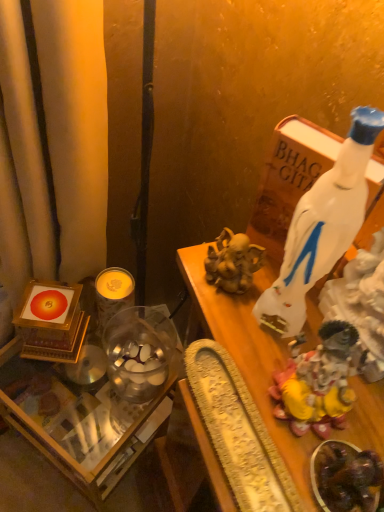
What is the approximate height of white glossy bottle at upper right?

white glossy bottle at upper right is 9.75 inches in height.

What are the coordinates of `shiny dark chocolate at lower right` in the screenshot? It's located at (345, 477).

What is the approximate width of translucent glass table at lower left?

It is 14.54 inches.

Image resolution: width=384 pixels, height=512 pixels. What do you see at coordinates (247, 354) in the screenshot? I see `gold textured tray at center` at bounding box center [247, 354].

I want to click on shiny gold statue at right, so click(x=317, y=382).

From the image's perspective, which is above, shiny gold statue at right or yellow wax candle at center left?

shiny gold statue at right is shown above in the image.

Considering the relative sizes of shiny gold statue at right and yellow wax candle at center left in the image provided, is shiny gold statue at right bigger than yellow wax candle at center left?

No, shiny gold statue at right is not bigger than yellow wax candle at center left.

Looking at this image, is shiny gold statue at right situated inside yellow wax candle at center left or outside?

shiny gold statue at right is located beyond the bounds of yellow wax candle at center left.

Where is `toy that is above the yellow wax candle at center left (from a real-world perspective)`? The image size is (384, 512). toy that is above the yellow wax candle at center left (from a real-world perspective) is located at coordinates (317, 382).

Is shiny dark chocolate at lower right oriented away from shiny gold statue at right?

No, shiny gold statue at right is not at the back of shiny dark chocolate at lower right.

Is point (341, 472) less distant than point (334, 412)?

That is True.

Is shiny dark chocolate at lower right spatially inside shiny gold statue at right, or outside of it?

shiny dark chocolate at lower right is not inside shiny gold statue at right, it's outside.

Based on the photo, is shiny dark chocolate at lower right placed right next to shiny gold statue at right?

Indeed, shiny dark chocolate at lower right and shiny gold statue at right are beside each other and touching.

Would you consider shiny gold statue at right to be distant from white glossy bottle at upper right?

shiny gold statue at right is near white glossy bottle at upper right, not far away.

Would you say shiny gold statue at right contains white glossy bottle at upper right?

That's incorrect, white glossy bottle at upper right is not inside shiny gold statue at right.

Which is farther from the camera, (292, 361) or (291, 188)?

Point (291, 188)

Considering the relative positions of shiny gold statue at right and white glossy bottle at upper right in the image provided, is shiny gold statue at right to the right of white glossy bottle at upper right from the viewer's perspective?

Incorrect, shiny gold statue at right is not on the right side of white glossy bottle at upper right.

How many degrees apart are the facing directions of shiny dark chocolate at lower right and white glossy bottle at upper right?

The facing directions of shiny dark chocolate at lower right and white glossy bottle at upper right are 7.04 degrees apart.

From a real-world perspective, is shiny dark chocolate at lower right above or below white glossy bottle at upper right?

shiny dark chocolate at lower right is below white glossy bottle at upper right.

Is shiny dark chocolate at lower right surrounding white glossy bottle at upper right?

Definitely not — white glossy bottle at upper right is not inside shiny dark chocolate at lower right.

Is shiny dark chocolate at lower right in front of or behind white glossy bottle at upper right in the image?

shiny dark chocolate at lower right is positioned farther from the viewer than white glossy bottle at upper right.

Which object is positioned more to the right, shiny gold statue at right or gold textured tray at center?

Positioned to the right is shiny gold statue at right.

Based on the photo, is shiny gold statue at right positioned far away from gold textured tray at center?

Actually, shiny gold statue at right and gold textured tray at center are a little close together.

In terms of height, does shiny gold statue at right look taller or shorter compared to gold textured tray at center?

Clearly, shiny gold statue at right is shorter compared to gold textured tray at center.

Is shiny gold statue at right bigger or smaller than gold textured tray at center?

shiny gold statue at right is smaller than gold textured tray at center.

How much distance is there between gold textured tray at center and shiny gold statue at right?

gold textured tray at center and shiny gold statue at right are 1.99 inches apart from each other.

From the image's perspective, is gold textured tray at center above or below shiny gold statue at right?

From the image's perspective, gold textured tray at center appears below shiny gold statue at right.

Considering the sizes of gold textured tray at center and shiny gold statue at right in the image, is gold textured tray at center wider or thinner than shiny gold statue at right?

Clearly, gold textured tray at center has less width compared to shiny gold statue at right.

From a real-world perspective, which object rests below the other?

gold textured tray at center is physically lower.

Is yellow wax candle at center left aimed at translucent glass table at lower left?

No, yellow wax candle at center left is not facing towards translucent glass table at lower left.

Based on the photo, from the image's perspective, which is above, yellow wax candle at center left or translucent glass table at lower left?

yellow wax candle at center left appears higher in the image.

Is yellow wax candle at center left far from translucent glass table at lower left?

Actually, yellow wax candle at center left and translucent glass table at lower left are a little close together.

How distant is yellow wax candle at center left from translucent glass table at lower left?

yellow wax candle at center left is 10.26 inches from translucent glass table at lower left.

Where is `toy that appears above the yellow wax candle at center left (from the image's perspective)`? Image resolution: width=384 pixels, height=512 pixels. toy that appears above the yellow wax candle at center left (from the image's perspective) is located at coordinates (317, 382).

The width and height of the screenshot is (384, 512). Find the location of `toy on the left side of shiny dark chocolate at lower right`. toy on the left side of shiny dark chocolate at lower right is located at coordinates (317, 382).

Considering their positions, is gold textured tray at center positioned closer to shiny dark chocolate at lower right than shiny gold statue at right?

shiny gold statue at right is positioned closer to the anchor shiny dark chocolate at lower right.

Estimate the real-world distances between objects in this image. Which object is closer to yellow wax candle at center left, shiny gold statue at right or shiny dark chocolate at lower right?

Based on the image, shiny gold statue at right appears to be nearer to yellow wax candle at center left.

When comparing their distances from translucent glass table at lower left, does shiny gold statue at right or shiny dark chocolate at lower right seem further?

Among the two, shiny dark chocolate at lower right is located further to translucent glass table at lower left.

When comparing their distances from translucent glass table at lower left, does gold textured tray at center or yellow wax candle at center left seem closer?

yellow wax candle at center left lies closer to translucent glass table at lower left than the other object.

Considering their positions, is white glossy bottle at upper right positioned closer to shiny dark chocolate at lower right than shiny gold statue at right?

Based on the image, shiny gold statue at right appears to be nearer to shiny dark chocolate at lower right.

Which object lies nearer to the anchor point shiny gold statue at right, gold textured tray at center or shiny dark chocolate at lower right?

The object closer to shiny gold statue at right is gold textured tray at center.

Considering their positions, is translucent glass table at lower left positioned closer to shiny gold statue at right than white glossy bottle at upper right?

Based on the image, white glossy bottle at upper right appears to be nearer to shiny gold statue at right.

Estimate the real-world distances between objects in this image. Which object is further from gold textured tray at center, translucent glass table at lower left or shiny gold statue at right?

The object further to gold textured tray at center is translucent glass table at lower left.

The height and width of the screenshot is (512, 384). Identify the location of furniture between white glossy bottle at upper right and shiny dark chocolate at lower right from top to bottom. (247, 354).

Where is `toy positioned between shiny dark chocolate at lower right and yellow wax candle at center left from near to far`? Image resolution: width=384 pixels, height=512 pixels. toy positioned between shiny dark chocolate at lower right and yellow wax candle at center left from near to far is located at coordinates (317, 382).

Where is `bottle between gold textured tray at center and translucent glass table at lower left from front to back`? This screenshot has height=512, width=384. bottle between gold textured tray at center and translucent glass table at lower left from front to back is located at coordinates (314, 211).

At what (x,y) coordinates should I click in order to perform the action: click on food positioned between gold textured tray at center and yellow wax candle at center left from near to far. Please return your answer as a coordinate pair (x, y). The height and width of the screenshot is (512, 384). Looking at the image, I should click on (345, 477).